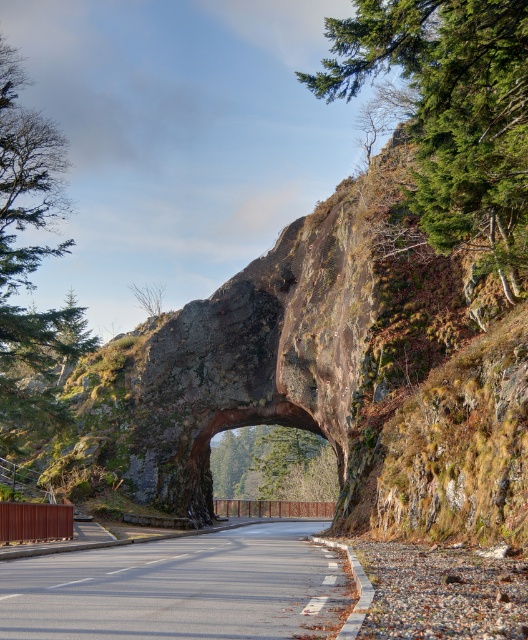
Who is more distant from viewer, (487, 250) or (106, 612)?

The point (487, 250) is more distant.

Is point (366, 51) positioned before point (41, 636)?

No, it is not.

At what (x,y) coordinates should I click in order to perform the action: click on green rough rock at upper right. Please return your answer as a coordinate pair (x, y). The height and width of the screenshot is (640, 528). Looking at the image, I should click on click(x=450, y=113).

Find the location of a particular element. green rough rock at upper right is located at coordinates [450, 113].

Does asphalt road at center appear under green textured tree at upper left?

Correct, asphalt road at center is located below green textured tree at upper left.

Which is below, asphalt road at center or green textured tree at upper left?

asphalt road at center is lower down.

The height and width of the screenshot is (640, 528). Describe the element at coordinates (183, 588) in the screenshot. I see `asphalt road at center` at that location.

Locate an element on the screen. asphalt road at center is located at coordinates (183, 588).

Based on the photo, who is positioned more to the right, green rough rock at upper right or green textured tree at upper left?

From the viewer's perspective, green rough rock at upper right appears more on the right side.

This screenshot has width=528, height=640. What are the coordinates of `green rough rock at upper right` in the screenshot? It's located at point(450,113).